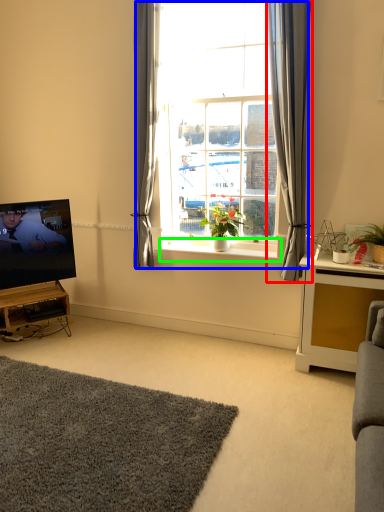
Question: Which object is the closest to the curtain (highlighted by a red box)? Choose among these: window (highlighted by a blue box) or window sill (highlighted by a green box).

Choices:
 (A) window
 (B) window sill

Answer: (A)